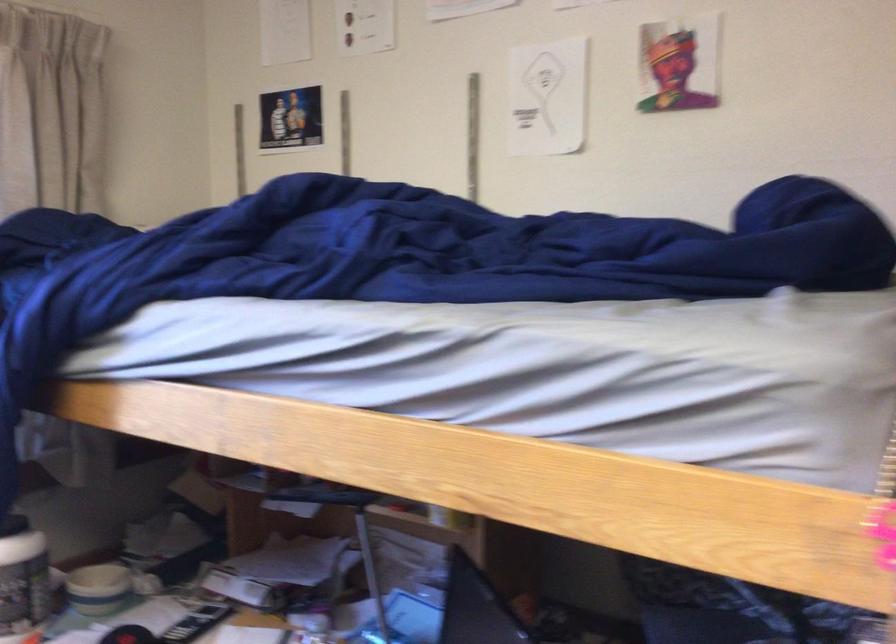
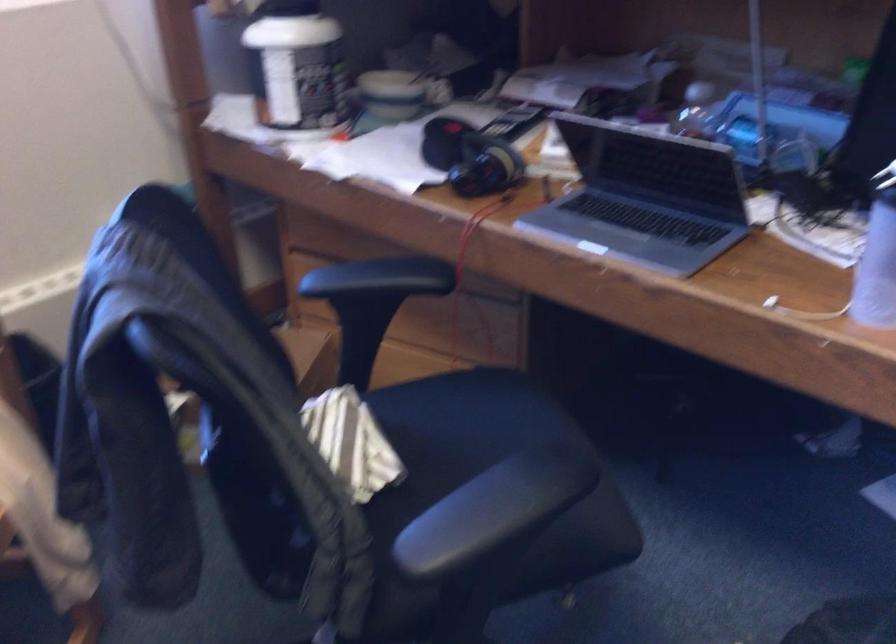
Question: The first image is from the beginning of the video and the second image is from the end. How did the camera likely rotate when shooting the video?

Choices:
 (A) Left
 (B) Right
 (C) Up
 (D) Down

Answer: (D)